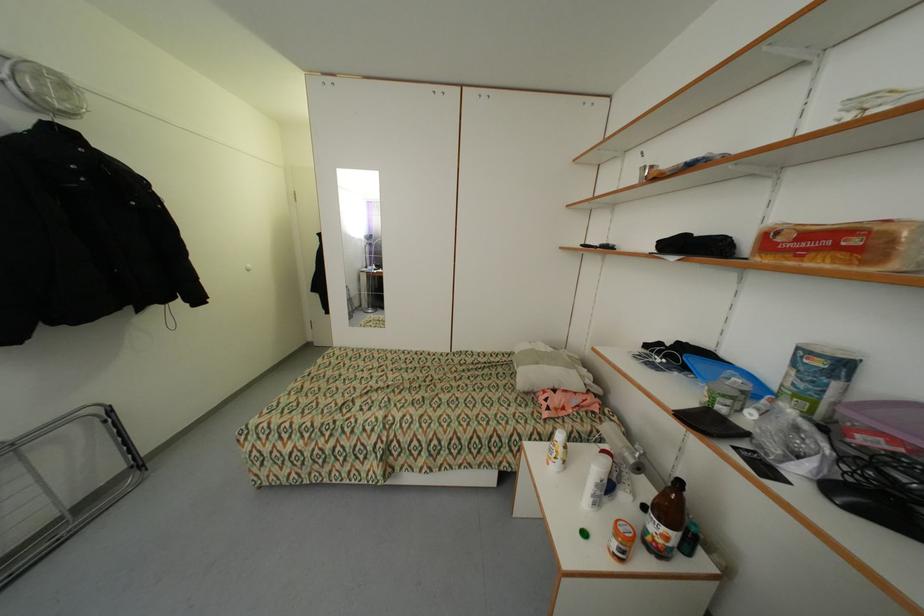
Find the location of a particular element. packaged toast bread is located at coordinates (844, 245).